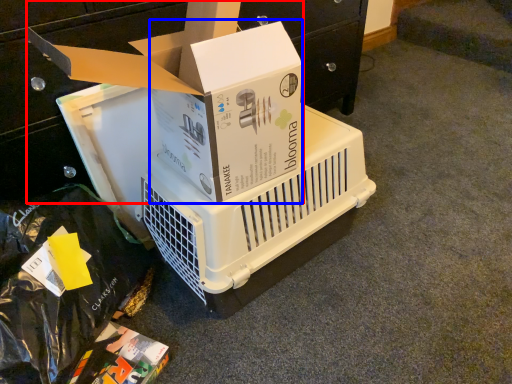
Question: Which object is closer to the camera taking this photo, box (highlighted by a red box) or box (highlighted by a blue box)?

Choices:
 (A) box
 (B) box

Answer: (A)